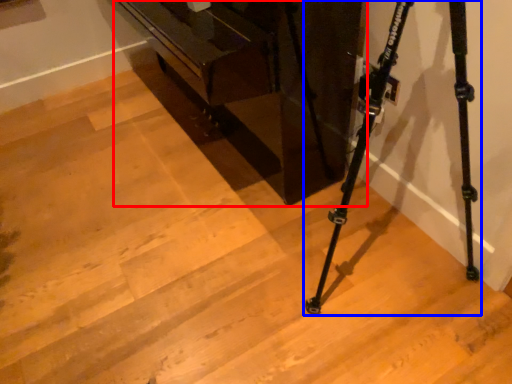
Question: Among these objects, which one is farthest to the camera, furniture (highlighted by a red box) or tripod (highlighted by a blue box)?

Choices:
 (A) furniture
 (B) tripod

Answer: (A)